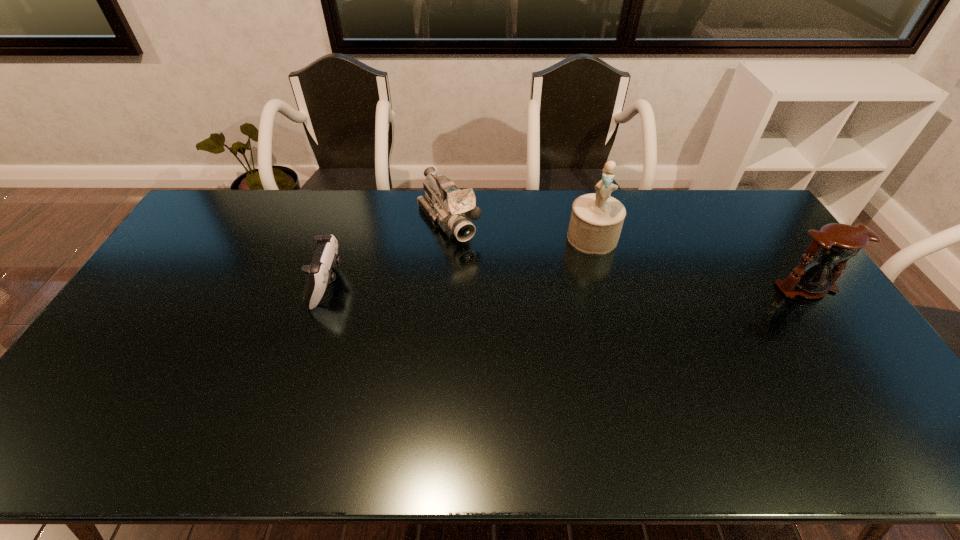
The image size is (960, 540). Find the location of `free space between the camcorder and the second object from right to left`. free space between the camcorder and the second object from right to left is located at coordinates (520, 230).

At what (x,y) coordinates should I click in order to perform the action: click on empty location between the figurine and the second object from left to right. Please return your answer as a coordinate pair (x, y). This screenshot has width=960, height=540. Looking at the image, I should click on (520, 230).

Find the location of `free area in between the figurine and the leftmost object`. free area in between the figurine and the leftmost object is located at coordinates (460, 261).

Identify the location of vacant point located between the rightmost object and the third object from right to left. Image resolution: width=960 pixels, height=540 pixels. (627, 255).

Identify which object is the second closest to the shortest object. Please provide its 2D coordinates. Your answer should be formatted as a tuple, i.e. [(x, y)], where the tuple contains the x and y coordinates of a point satisfying the conditions above.

[(596, 221)]

Locate which object is the second closest to the third object from right to left. Please provide its 2D coordinates. Your answer should be formatted as a tuple, i.e. [(x, y)], where the tuple contains the x and y coordinates of a point satisfying the conditions above.

[(596, 221)]